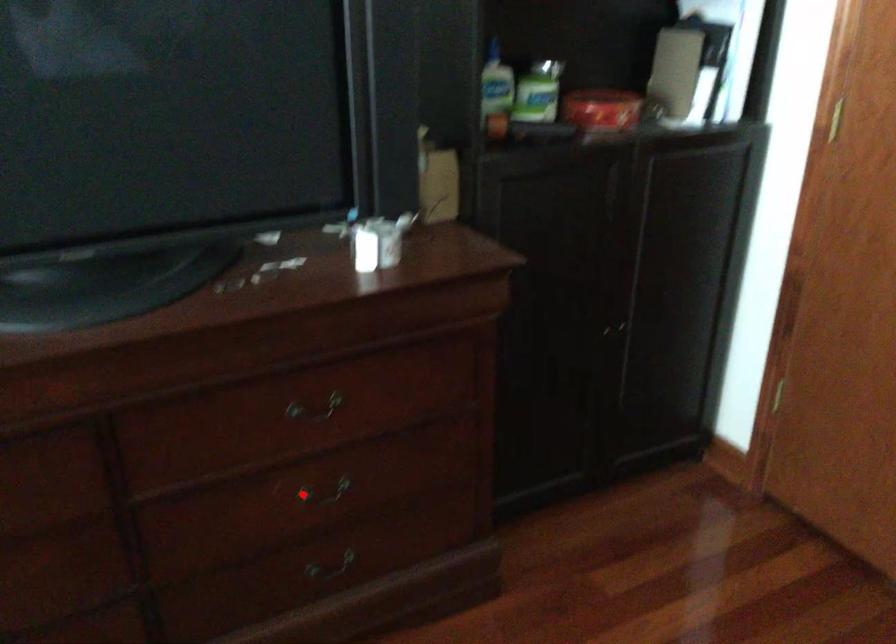
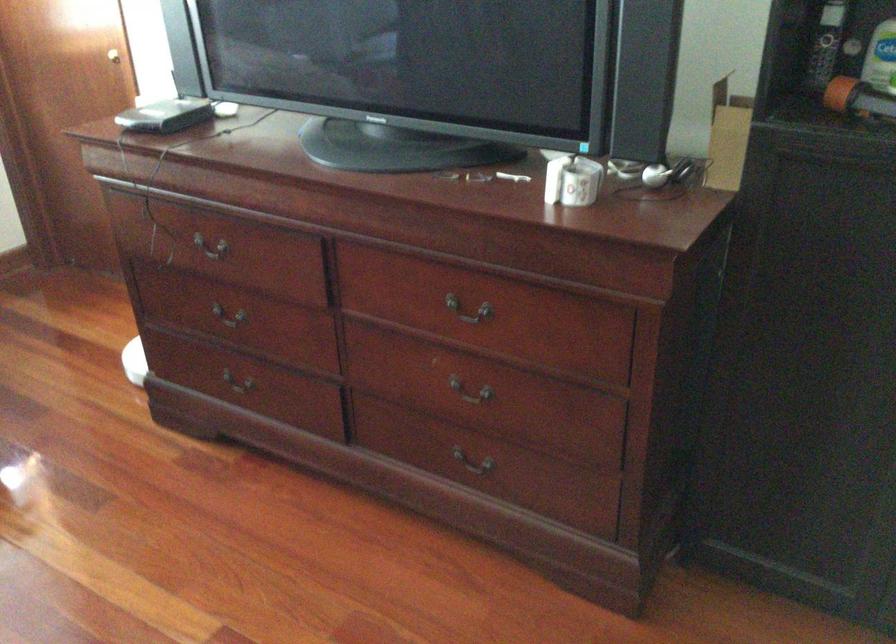
Question: I am providing you with two images of the same scene from different viewpoints. A red point is shown in image1. For the corresponding object point in image2, is it positioned nearer or farther from the camera?

Choices:
 (A) Nearer
 (B) Farther

Answer: (B)